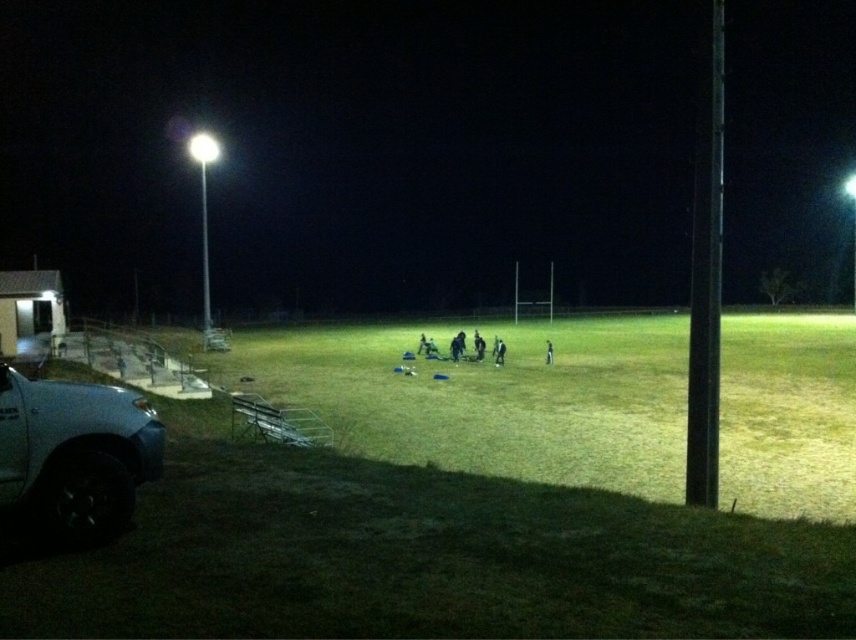
Does green grass football field at center have a larger size compared to black fabric person at center?

Yes.

Does green grass football field at center have a lesser height compared to black fabric person at center?

No.

Does point (603, 397) lie in front of point (551, 344)?

Yes, point (603, 397) is in front of point (551, 344).

Locate an element on the screen. green grass football field at center is located at coordinates (492, 397).

Is green grass at center bigger than green grass football field at center?

Correct, green grass at center is larger in size than green grass football field at center.

Who is more distant from viewer, (204, 49) or (853, 449)?

The point (204, 49) is more distant.

At what (x,y) coordinates should I click in order to perform the action: click on green grass at center. Please return your answer as a coordinate pair (x, y). Looking at the image, I should click on (351, 148).

Can you confirm if green grass football field at center is positioned below silver metallic truck at lower left?

Yes, green grass football field at center is below silver metallic truck at lower left.

Does green grass football field at center have a smaller size compared to silver metallic truck at lower left?

No, green grass football field at center is not smaller than silver metallic truck at lower left.

Which is behind, point (722, 339) or point (78, 438)?

The point (722, 339) is more distant.

Where is `green grass football field at center`? green grass football field at center is located at coordinates (492, 397).